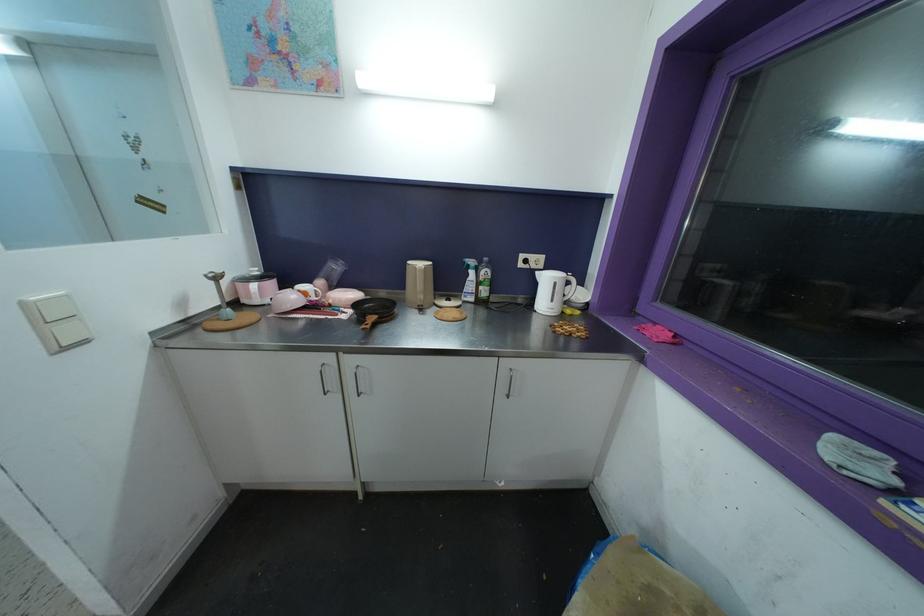
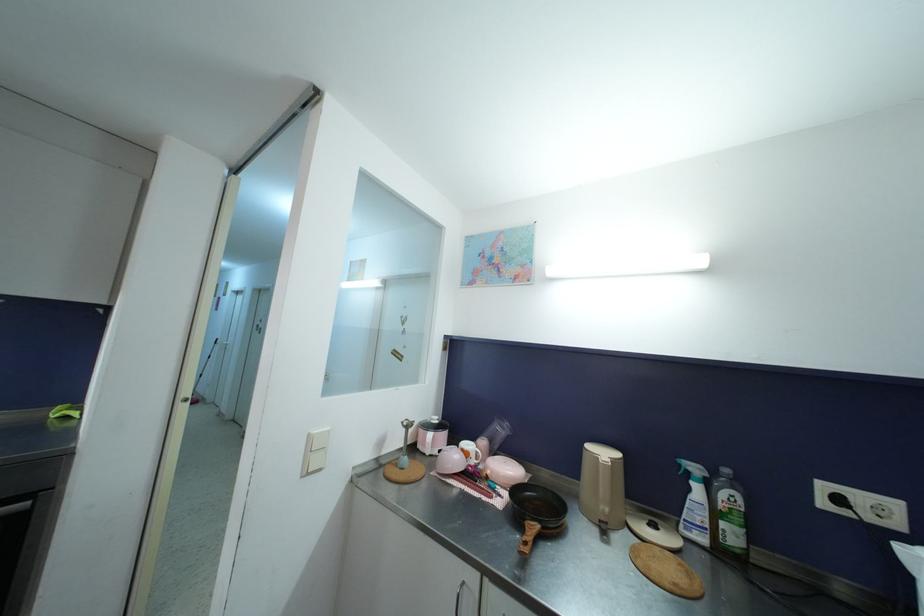
Locate, in the second image, the point that corresponds to point 272,304 in the first image.

(439, 456)